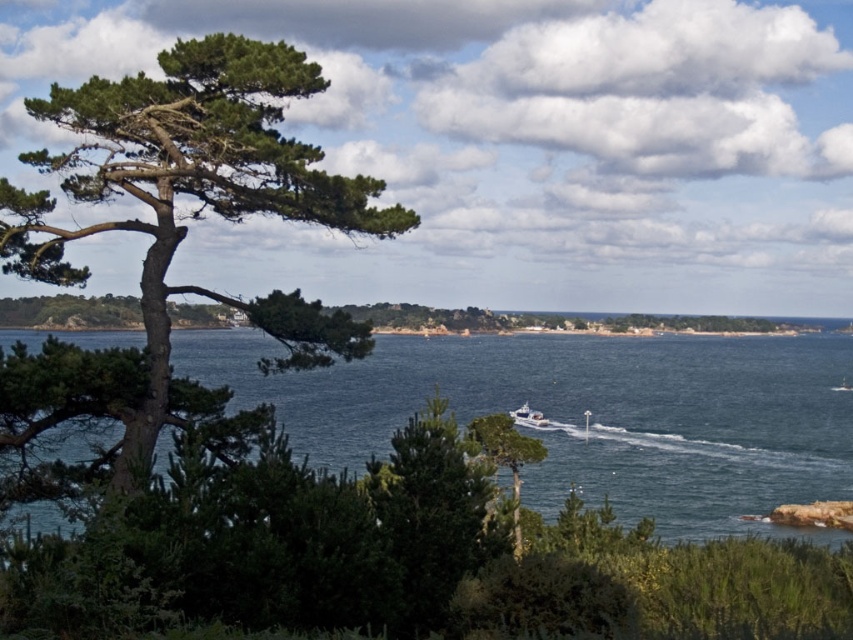
Question: Can you confirm if blue water at center is positioned to the left of green matte tree at center?

Choices:
 (A) yes
 (B) no

Answer: (A)

Question: Where is green rough bark tree at left located in relation to white glossy boat at center in the image?

Choices:
 (A) below
 (B) above

Answer: (B)

Question: Which point is closer to the camera taking this photo?

Choices:
 (A) (483, 424)
 (B) (718, 476)

Answer: (A)

Question: Which is nearer to the blue water at center?

Choices:
 (A) green rough bark tree at left
 (B) white glossy boat at center
 (C) green matte tree at center

Answer: (B)

Question: Which object is the closest to the green rough bark tree at left?

Choices:
 (A) white glossy boat at center
 (B) green matte tree at center
 (C) blue water at center

Answer: (B)

Question: Can you confirm if blue water at center is positioned above green matte tree at center?

Choices:
 (A) yes
 (B) no

Answer: (A)